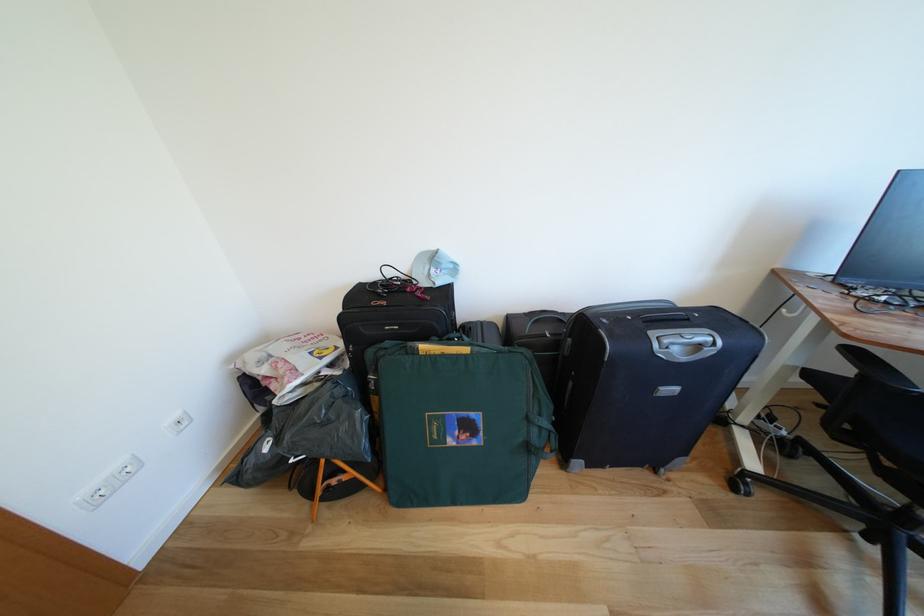
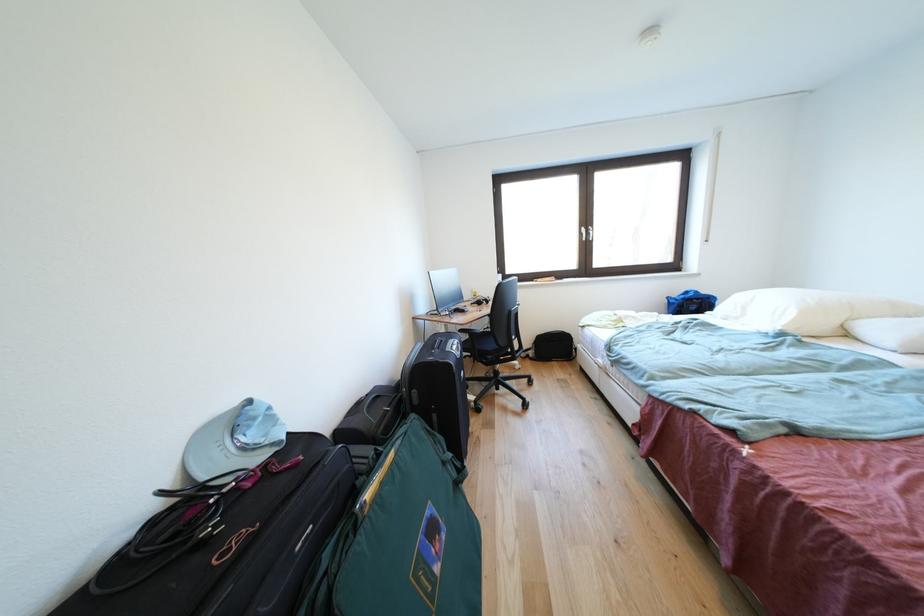
Question: The camera is either moving clockwise (left) or counter-clockwise (right) around the object. The first image is from the beginning of the video and the second image is from the end. Is the camera moving left or right when shooting the video?

Choices:
 (A) Left
 (B) Right

Answer: (A)